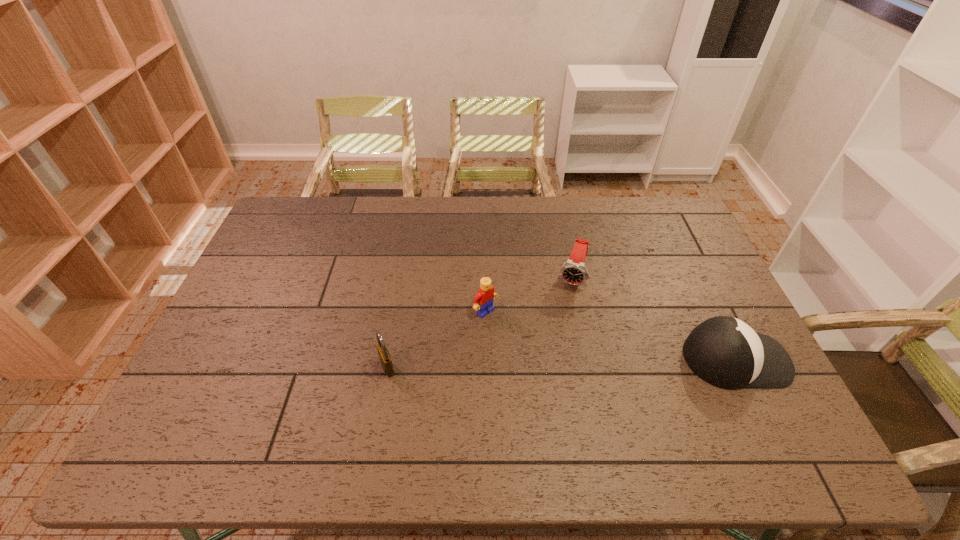
At what (x,y) coordinates should I click in order to perform the action: click on vacant region at the far right corner of the desktop. Please return your answer as a coordinate pair (x, y). Looking at the image, I should click on (636, 197).

At what (x,y) coordinates should I click in order to perform the action: click on free spot between the padlock and the cap. Please return your answer as a coordinate pair (x, y). Image resolution: width=960 pixels, height=540 pixels. Looking at the image, I should click on coord(562,363).

You are a GUI agent. You are given a task and a screenshot of the screen. Output one action in this format:
    pyautogui.click(x=<x>, y=<y>)
    Task: Click on the free space between the watch and the third nearest object
    The width and height of the screenshot is (960, 540).
    Given the screenshot: What is the action you would take?
    pyautogui.click(x=529, y=294)

This screenshot has height=540, width=960. Identify the location of vacant area that lies between the third object from left to right and the rightmost object. (654, 319).

Where is `free space between the rightmost object and the padlock`? The width and height of the screenshot is (960, 540). free space between the rightmost object and the padlock is located at coordinates (562, 363).

Where is `free space between the leftmost object and the farthest object`? The height and width of the screenshot is (540, 960). free space between the leftmost object and the farthest object is located at coordinates (480, 322).

Image resolution: width=960 pixels, height=540 pixels. Find the location of `unoccupied area between the leftmost object and the Lego`. unoccupied area between the leftmost object and the Lego is located at coordinates (x=437, y=339).

Where is `unoccupied area between the padlock and the second farthest object`? The image size is (960, 540). unoccupied area between the padlock and the second farthest object is located at coordinates (437, 339).

Identify the location of unoccupied position between the cap and the second object from right to left. (654, 319).

Image resolution: width=960 pixels, height=540 pixels. I want to click on free spot between the watch and the rightmost object, so click(654, 319).